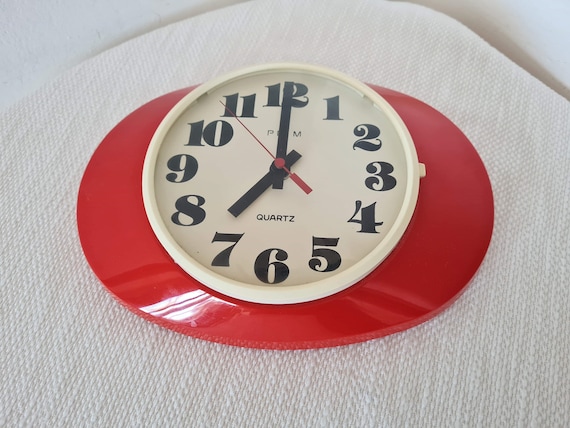
The image size is (570, 428). Identify the location of "4" on clock face. (366, 217).